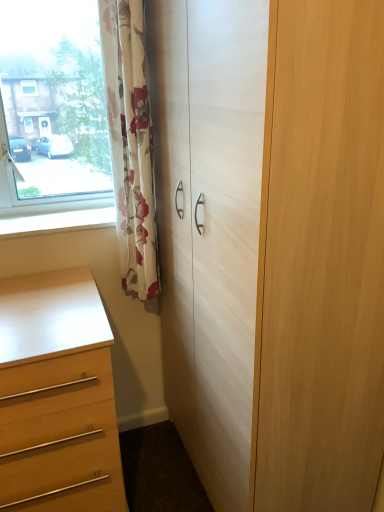
This screenshot has width=384, height=512. In order to click on empty space that is ontop of matte wood chest of drawers at lower left in this screenshot , I will do tap(44, 308).